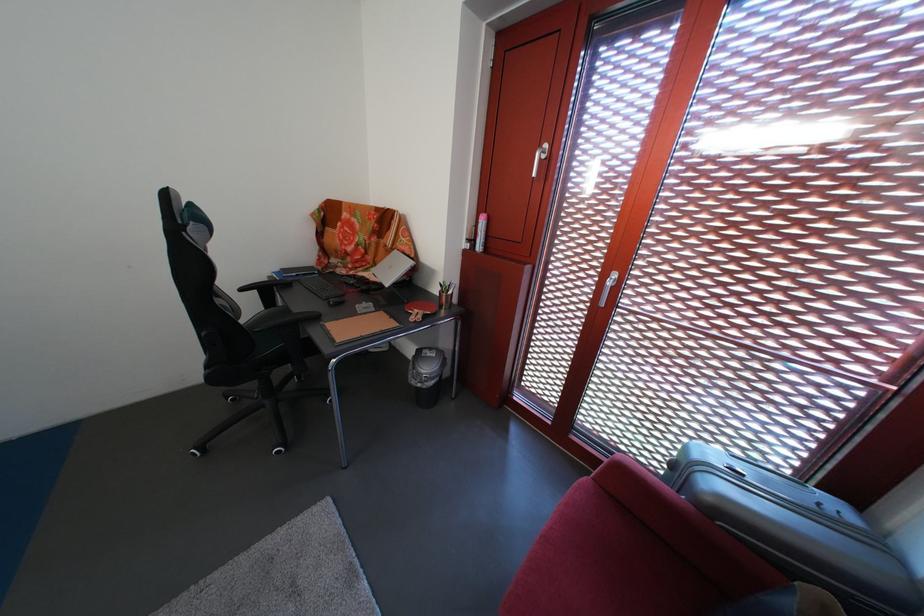
I want to click on red ping-pong paddle, so click(x=419, y=309).